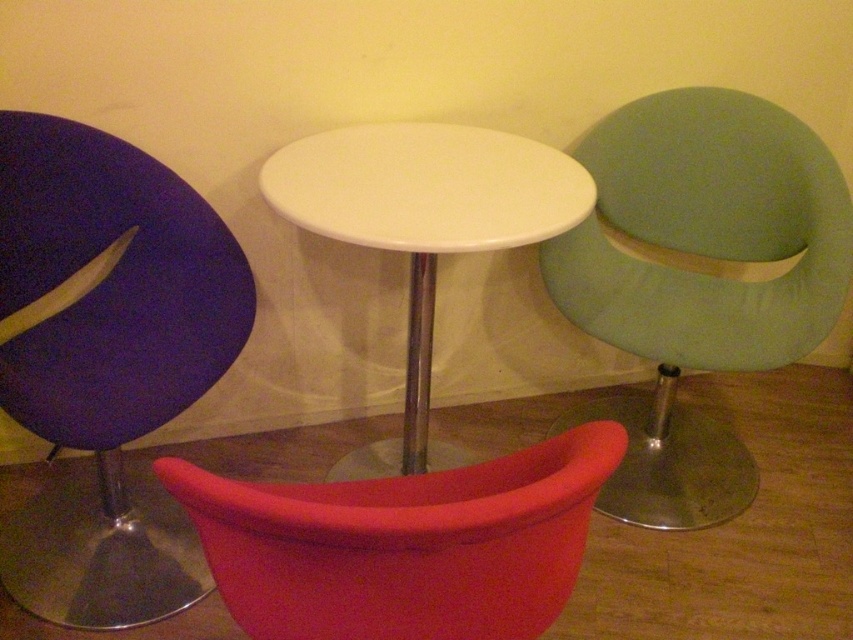
Question: Which object appears farthest from the camera in this image?

Choices:
 (A) matte green armchair at right
 (B) white glossy side table at center

Answer: (A)

Question: Does matte purple chair at left have a greater width compared to matte red swivel chair at lower center?

Choices:
 (A) no
 (B) yes

Answer: (A)

Question: Is matte purple chair at left positioned at the back of matte red swivel chair at lower center?

Choices:
 (A) no
 (B) yes

Answer: (B)

Question: Which object appears closest to the camera in this image?

Choices:
 (A) white glossy side table at center
 (B) matte red swivel chair at lower center
 (C) matte green armchair at right

Answer: (B)

Question: Which point is farther from the camera taking this photo?

Choices:
 (A) (21, 545)
 (B) (264, 552)

Answer: (A)

Question: Does matte purple chair at left appear on the left side of matte green armchair at right?

Choices:
 (A) no
 (B) yes

Answer: (B)